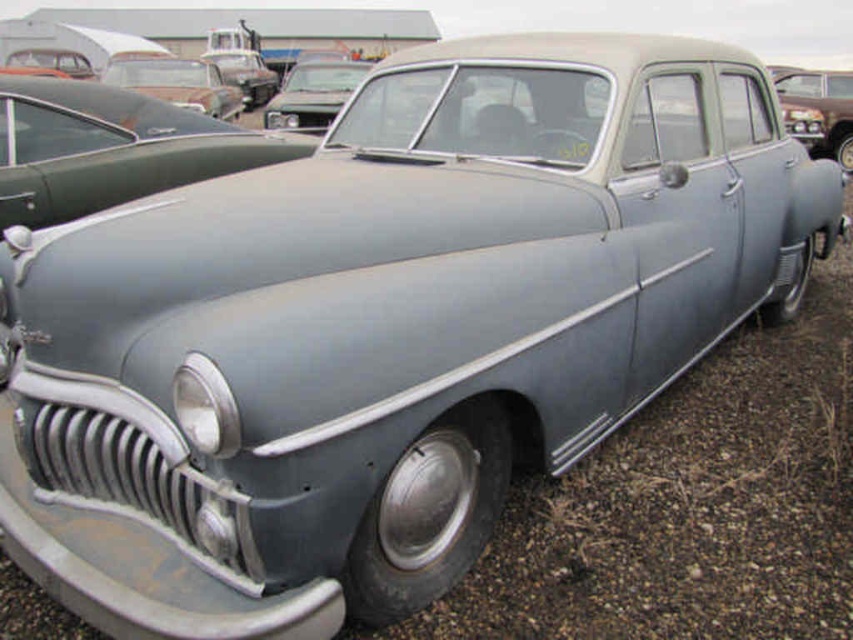
You are a parking attendant and need to move the matte gray car at upper right and the rusty metal car at upper left. Which car is positioned to the right side of the other?

The matte gray car at upper right is positioned to the right of the rusty metal car at upper left.

You are a photographer trying to capture both the matte gray car at center and the matte gray car at upper right in a single shot. Which car should you position closer to the camera to ensure both are fully visible in the frame?

You should position the matte gray car at center closer to the camera because it is shorter than the matte gray car at upper right. This way, both cars will fit within the frame without one being cut off.